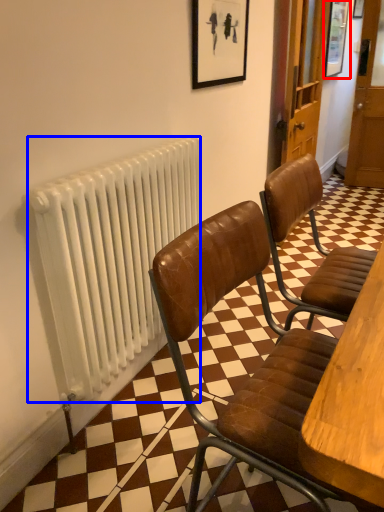
Question: Which object appears farthest to the camera in this image, picture frame (highlighted by a red box) or radiator (highlighted by a blue box)?

Choices:
 (A) picture frame
 (B) radiator

Answer: (A)